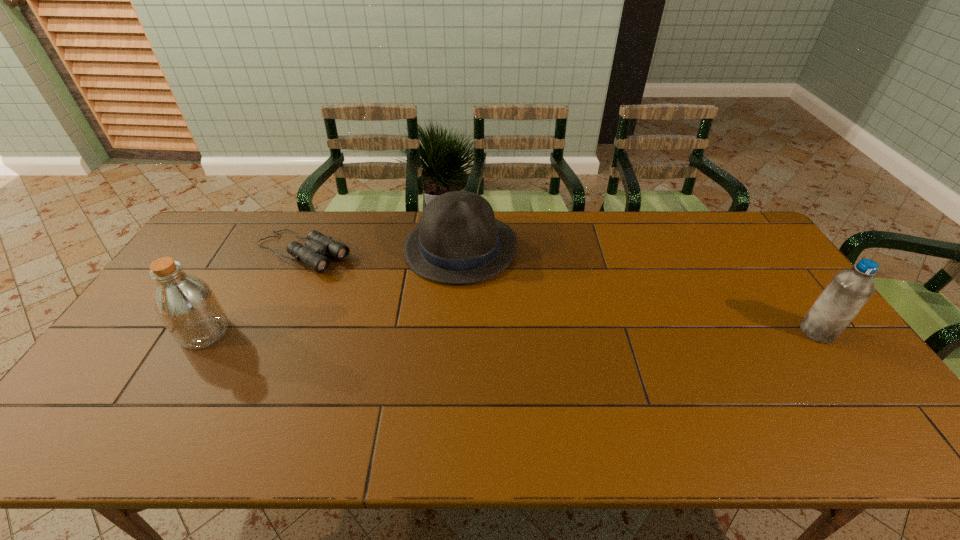
Identify the location of vacant region between the shortest object and the bottle. Image resolution: width=960 pixels, height=540 pixels. (253, 293).

Locate an element on the screen. This screenshot has width=960, height=540. free space between the water bottle and the bottle is located at coordinates (511, 332).

In order to click on object that is the closest one to the shortest object in this screenshot , I will do `click(188, 307)`.

At what (x,y) coordinates should I click in order to perform the action: click on object that is the second closest to the binoculars. Please return your answer as a coordinate pair (x, y). The height and width of the screenshot is (540, 960). Looking at the image, I should click on (458, 240).

At what (x,y) coordinates should I click in order to perform the action: click on free space in the image that satisfies the following two spatial constraints: 1. on the front side of the water bottle; 2. on the left side of the shortest object. Please return your answer as a coordinate pair (x, y). The image size is (960, 540). Looking at the image, I should click on (267, 332).

Identify the location of vacant region that satisfies the following two spatial constraints: 1. on the back side of the third tallest object; 2. on the left side of the bottle. (254, 248).

The width and height of the screenshot is (960, 540). Identify the location of free region that satisfies the following two spatial constraints: 1. on the back side of the bottle; 2. on the right side of the water bottle. (204, 332).

I want to click on vacant area that satisfies the following two spatial constraints: 1. on the back side of the bottle; 2. on the right side of the bowler hat, so click(x=254, y=248).